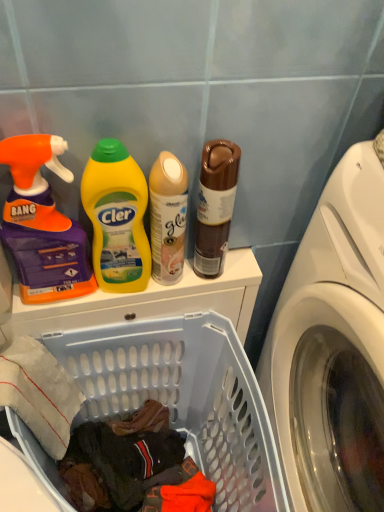
Question: Considering the positions of orange matte spray bottle at left, the 3th cleaning product viewed from the right, and yellow plastic bottle at center, which appears as the 2th cleaning product when viewed from the left, in the image, is orange matte spray bottle at left, the 3th cleaning product viewed from the right, wider or thinner than yellow plastic bottle at center, which appears as the 2th cleaning product when viewed from the left,?

Choices:
 (A) wide
 (B) thin

Answer: (A)

Question: Relative to yellow plastic bottle at center, which appears as the 2th cleaning product when viewed from the left, is orange matte spray bottle at left, the 3th cleaning product viewed from the right, in front or behind?

Choices:
 (A) front
 (B) behind

Answer: (A)

Question: Estimate the real-world distances between objects in this image. Which object is closer to the translucent plastic laundry basket at lower left?

Choices:
 (A) white glossy washing machine at right
 (B) yellow plastic bottle at center, which appears as the 2th cleaning product when viewed from the left
 (C) orange matte spray bottle at left, the 3th cleaning product viewed from the right
 (D) matte beige spray can at center, acting as the 1th cleaning product starting from the right
 (E) brown matte can at upper center

Answer: (A)

Question: Which is farther from the brown matte can at upper center?

Choices:
 (A) translucent plastic laundry basket at lower left
 (B) white glossy washing machine at right
 (C) yellow plastic bottle at center, which appears as the 2th cleaning product when viewed from the left
 (D) matte beige spray can at center, acting as the 1th cleaning product starting from the right
 (E) orange matte spray bottle at left, the first cleaning product in the left-to-right sequence

Answer: (A)